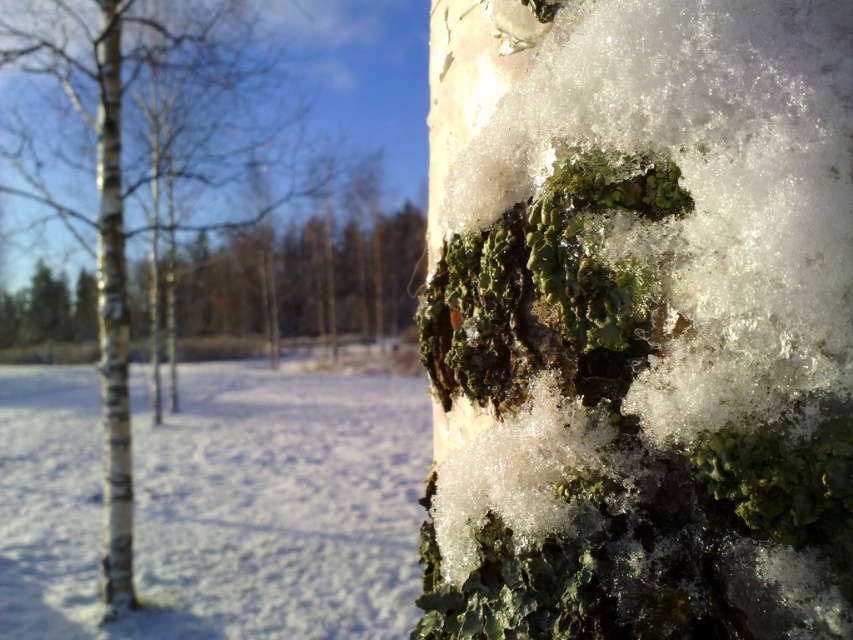
Question: Does white matte bark at center appear on the right side of white bark tree trunk at left?

Choices:
 (A) no
 (B) yes

Answer: (B)

Question: Is white matte bark at center to the left of white bark tree trunk at left from the viewer's perspective?

Choices:
 (A) yes
 (B) no

Answer: (B)

Question: Which of the following is the farthest from the observer?

Choices:
 (A) (128, 481)
 (B) (90, 228)

Answer: (B)

Question: Does white matte bark at center have a lesser width compared to white bark tree trunk at left?

Choices:
 (A) no
 (B) yes

Answer: (A)